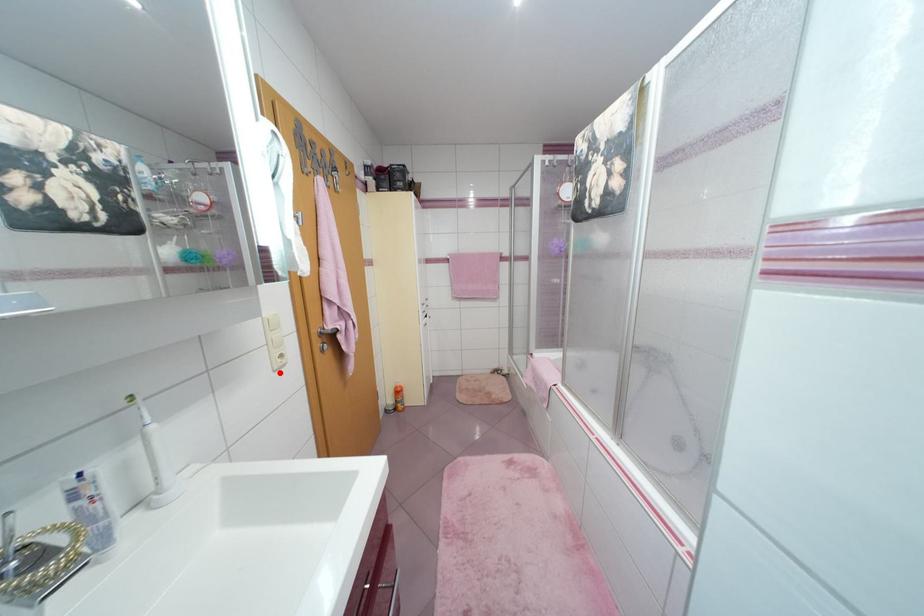
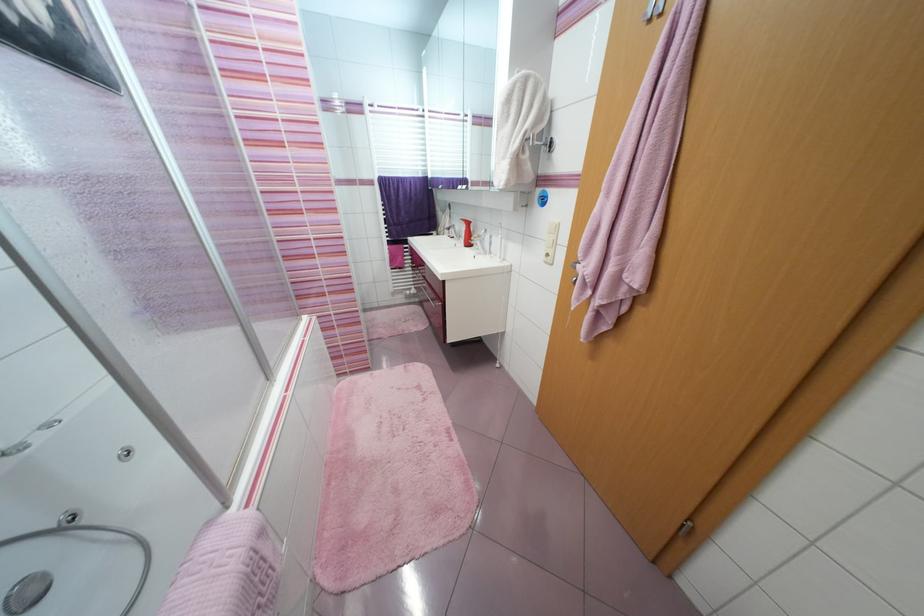
The point at the highlighted location is marked in the first image. Where is the corresponding point in the second image?

(551, 264)